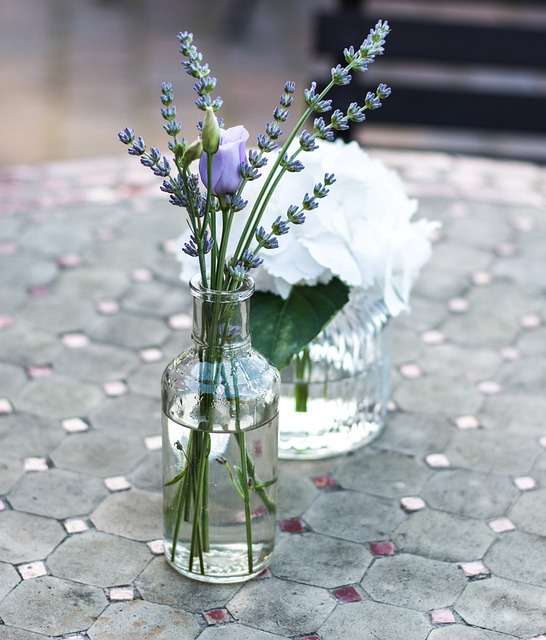
The image size is (546, 640). In order to click on light hitting vase in this screenshot , I will do `click(358, 349)`.